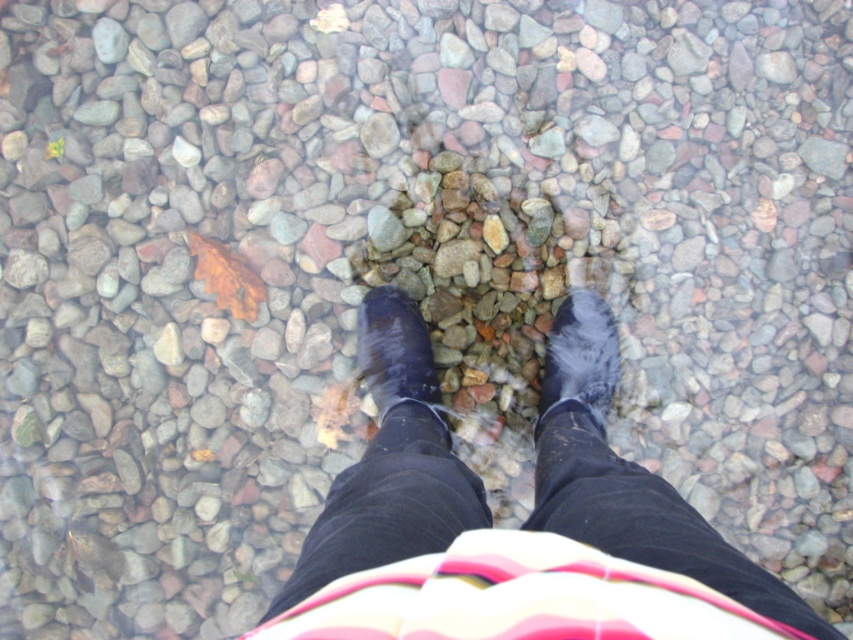
Question: Does wet rubber boots at center appear under shiny black boot at center?

Choices:
 (A) no
 (B) yes

Answer: (B)

Question: Considering the real-world distances, which object is closest to the wet rubber boots at center?

Choices:
 (A) shiny black boot at center
 (B) rubber/matte shoe at center

Answer: (A)

Question: Does wet rubber boots at center appear on the right side of rubber/matte shoe at center?

Choices:
 (A) no
 (B) yes

Answer: (A)

Question: Which of these objects is positioned farthest from the wet rubber boots at center?

Choices:
 (A) shiny black boot at center
 (B) rubber/matte shoe at center

Answer: (B)

Question: Estimate the real-world distances between objects in this image. Which object is closer to the rubber/matte shoe at center?

Choices:
 (A) wet rubber boots at center
 (B) shiny black boot at center

Answer: (A)

Question: Does wet rubber boots at center have a smaller size compared to rubber/matte shoe at center?

Choices:
 (A) yes
 (B) no

Answer: (B)